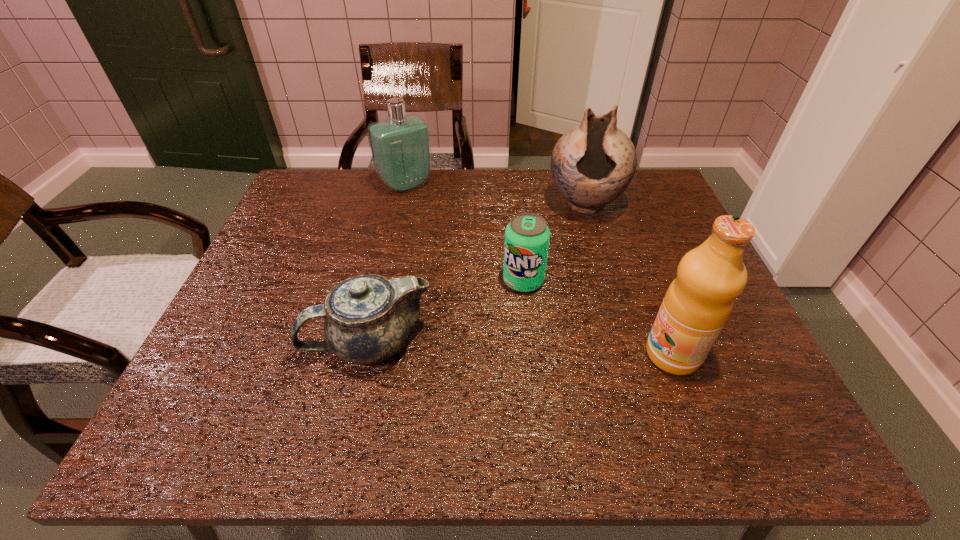
Where is `free spot on the desktop that is between the chinaware and the fruit juice and is positioned from the spout of the pottery`? The height and width of the screenshot is (540, 960). free spot on the desktop that is between the chinaware and the fruit juice and is positioned from the spout of the pottery is located at coordinates (563, 350).

Locate an element on the screen. vacant spot on the desktop that is between the chinaware and the fruit juice and is positioned on the front-facing side of the third object from left to right is located at coordinates (513, 348).

The width and height of the screenshot is (960, 540). In order to click on vacant spot on the desktop that is between the chinaware and the fruit juice and is positioned on the front label of the perfume in this screenshot , I will do `click(545, 349)`.